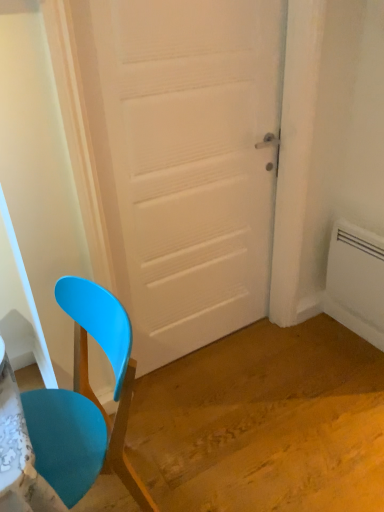
The height and width of the screenshot is (512, 384). I want to click on free spot in front of white matte door at center, so click(x=224, y=422).